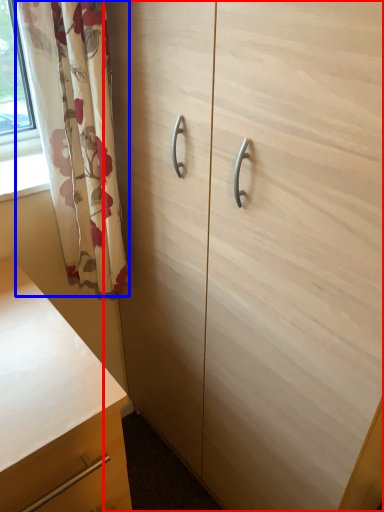
Question: Which object appears closest to the camera in this image, cabinetry (highlighted by a red box) or curtain (highlighted by a blue box)?

Choices:
 (A) cabinetry
 (B) curtain

Answer: (A)